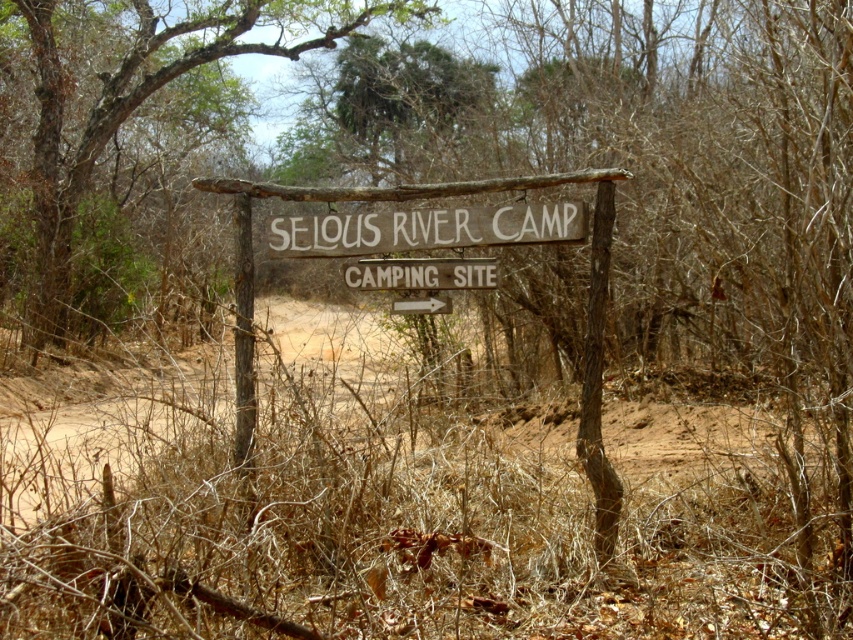
You are a hiker who has reached the wooden signboard at center. According to the sign, which direction should you go to reach the camping site?

The wooden signboard at center has an arrow pointing to the right, so you should go in the direction the arrow indicates to reach the camping site.

You are a hiker carrying a backpack and want to reach the camping site indicated by the brown wood sign at center. If you can walk 1.5 meters per second, how many seconds will it take you to reach the sign?

The brown wood sign at center is 13.15 meters away. At a walking speed of 1.5 meters per second, it will take approximately 8.77 seconds to reach the sign.

In the scene shown: Wait, there seems to be a typo in the object labels. The first object is labeled as brown wood sign at center, while the second is brown wooden sign at center. Since they are the same object, perhaps there was a duplication error. Could you clarify or correct this discrepancy?

The objects listed appear to be duplicates with a minor spelling variation. The correct label should be either brown wood sign at center or brown wooden sign at center. Please verify the object labels for accuracy before proceeding.